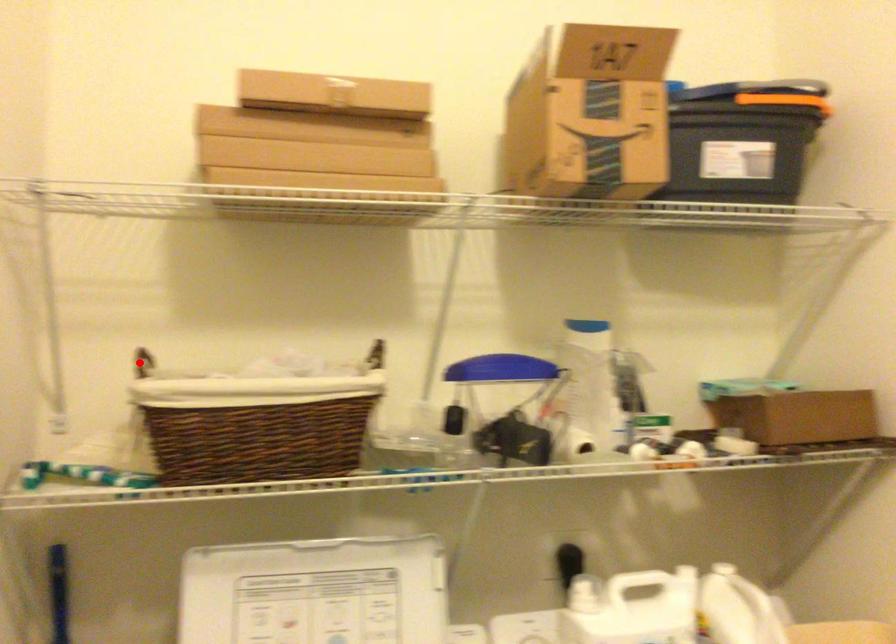
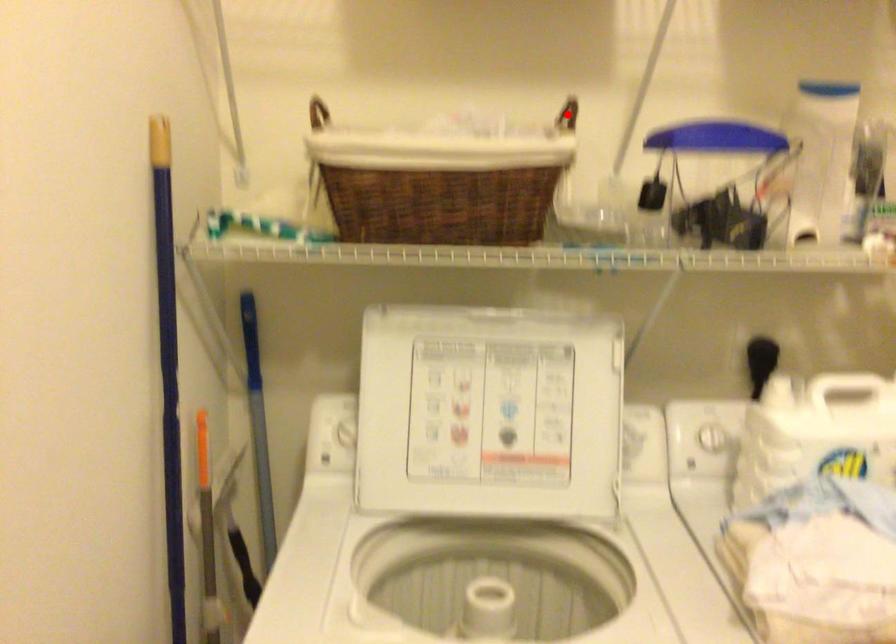
I am providing you with two images of the same scene from different viewpoints. A red point is marked on the first image and another point is marked on the second image. Is the red point in image1 aligned with the point shown in image2?

No